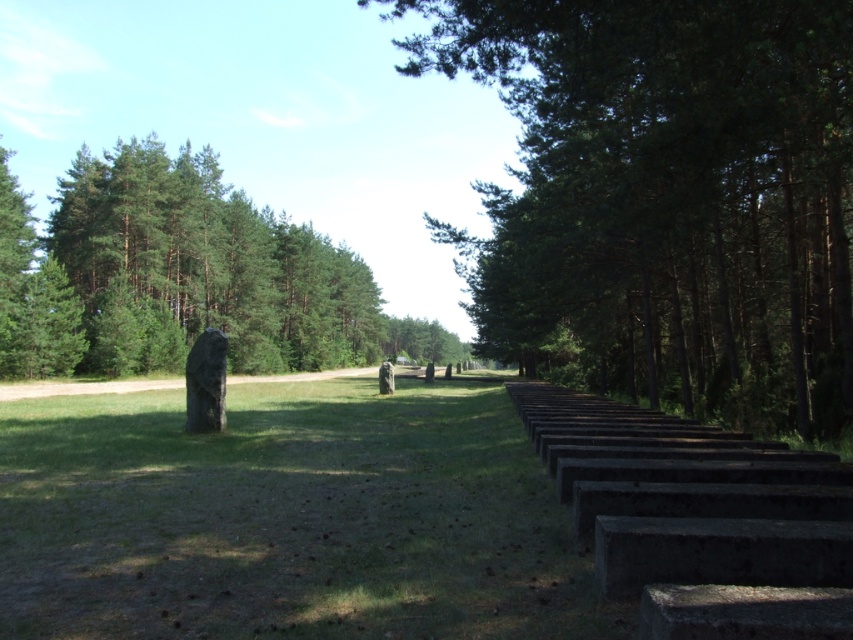
Question: Is green grass at center wider than green matte tree at left?

Choices:
 (A) yes
 (B) no

Answer: (B)

Question: Among these points, which one is nearest to the camera?

Choices:
 (A) (839, 38)
 (B) (218, 182)
 (C) (74, 547)

Answer: (C)

Question: Which of the following is the closest to the observer?

Choices:
 (A) (787, 42)
 (B) (148, 636)
 (C) (190, 154)

Answer: (B)

Question: Is green grass at center smaller than green matte tree at left?

Choices:
 (A) no
 (B) yes

Answer: (B)

Question: Considering the real-world distances, which object is closest to the green matte tree at left?

Choices:
 (A) green grass at center
 (B) green leafy trees at center

Answer: (B)

Question: Can you confirm if green grass at center is positioned to the left of green matte tree at left?

Choices:
 (A) yes
 (B) no

Answer: (B)